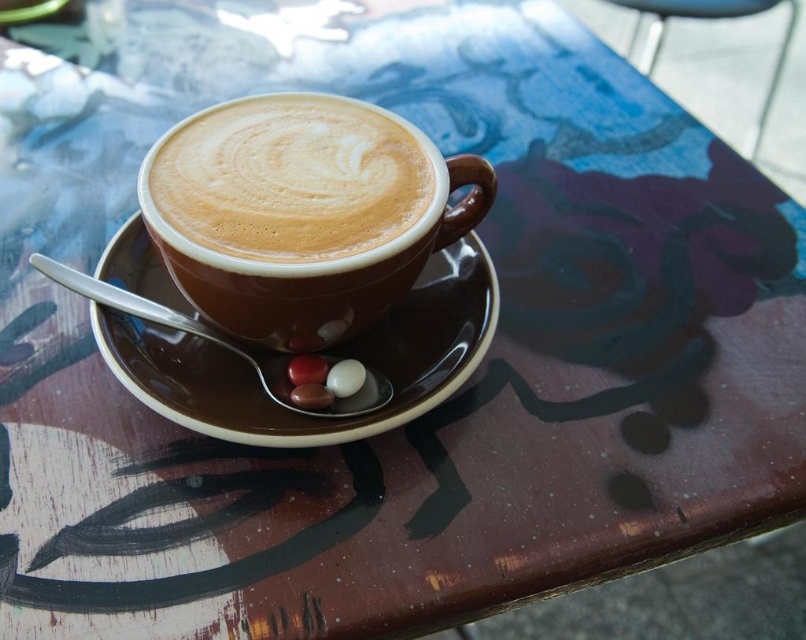
Can you confirm if cappuccino foam at center is wider than brown ceramic saucer at center?

No.

Is cappuccino foam at center closer to the viewer compared to brown ceramic saucer at center?

That is True.

Is point (190, 141) closer to viewer compared to point (109, 364)?

That is False.

The width and height of the screenshot is (806, 640). In order to click on cappuccino foam at center in this screenshot , I will do `click(289, 179)`.